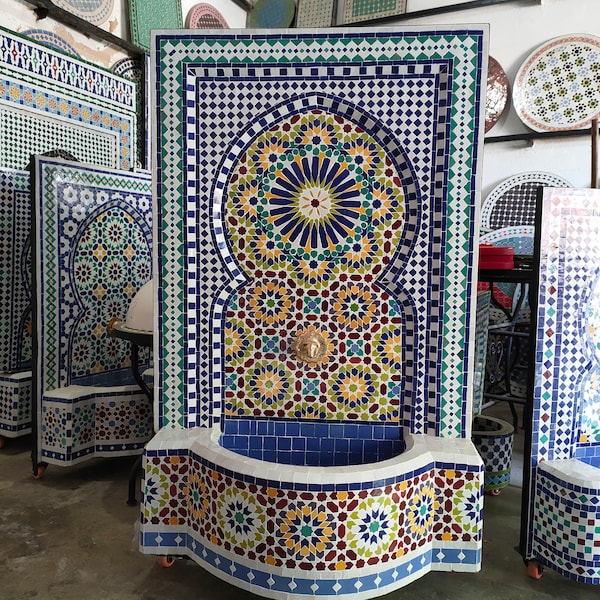
Identify the location of moroccan mosaic tile fountain in the middle. This screenshot has height=600, width=600. (383, 108).